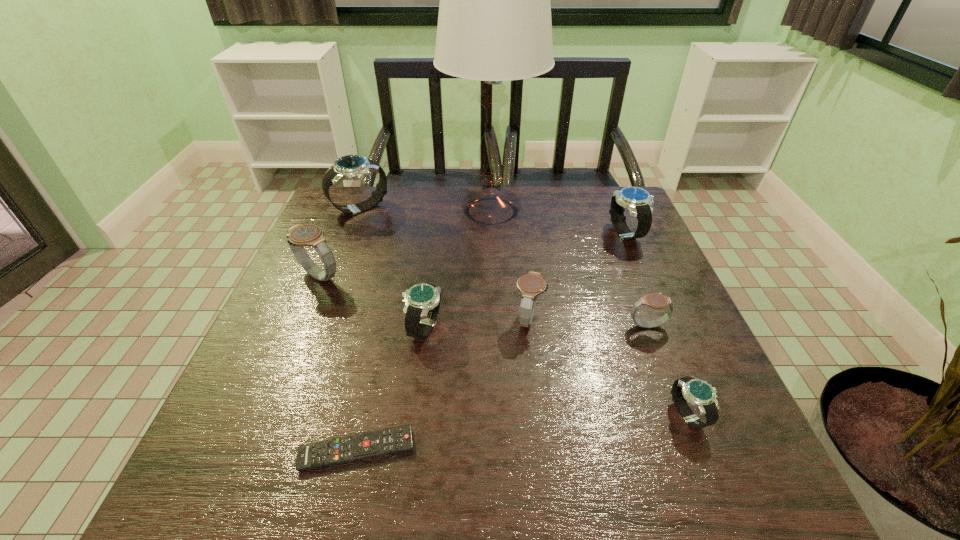
Identify the location of the nearest silver watch. The height and width of the screenshot is (540, 960). (699, 393).

At what (x,y) coordinates should I click in order to perform the action: click on the nearest watch. Please return your answer as a coordinate pair (x, y). The height and width of the screenshot is (540, 960). Looking at the image, I should click on [699, 393].

In order to click on the shortest object in this screenshot , I will do `click(328, 452)`.

In order to click on free spot located 0.320m on the front-facing side of the tallest object in this screenshot , I will do `click(335, 211)`.

What are the coordinates of `vacant space located on the front-facing side of the tallest object` in the screenshot? It's located at (406, 211).

Where is `vacant space situated on the front-facing side of the tallest object`? This screenshot has height=540, width=960. vacant space situated on the front-facing side of the tallest object is located at coordinates (413, 211).

Find the location of `blank space located on the front of the leftmost silver watch`. blank space located on the front of the leftmost silver watch is located at coordinates (324, 305).

Find the location of a particular element. The width and height of the screenshot is (960, 540). vacant space located 0.150m on the front of the biggest gray watch is located at coordinates (293, 340).

Image resolution: width=960 pixels, height=540 pixels. What are the coordinates of `vacant space located on the front of the third smallest silver watch` in the screenshot? It's located at (680, 359).

Image resolution: width=960 pixels, height=540 pixels. In order to click on free space located on the back of the second gray watch from left to right in this screenshot , I will do `click(518, 224)`.